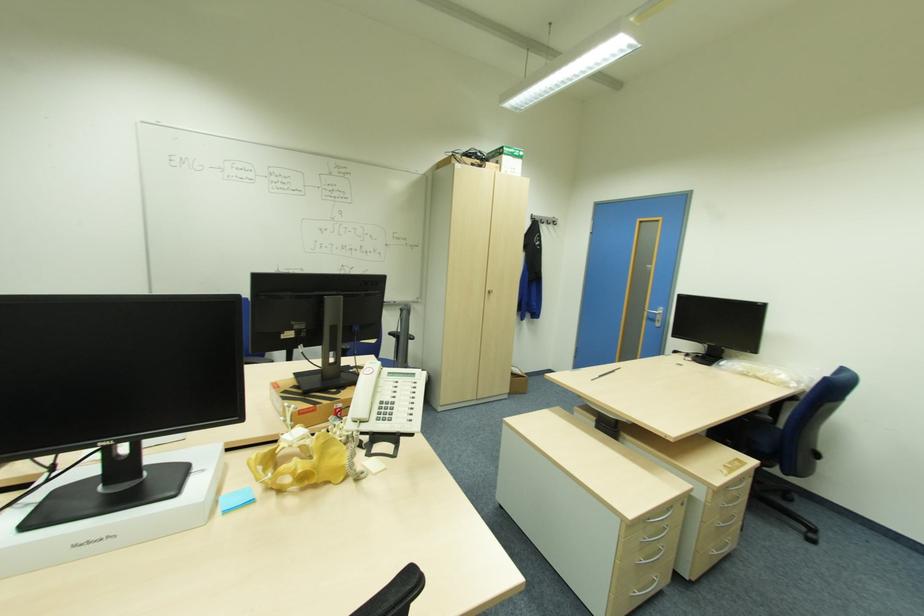
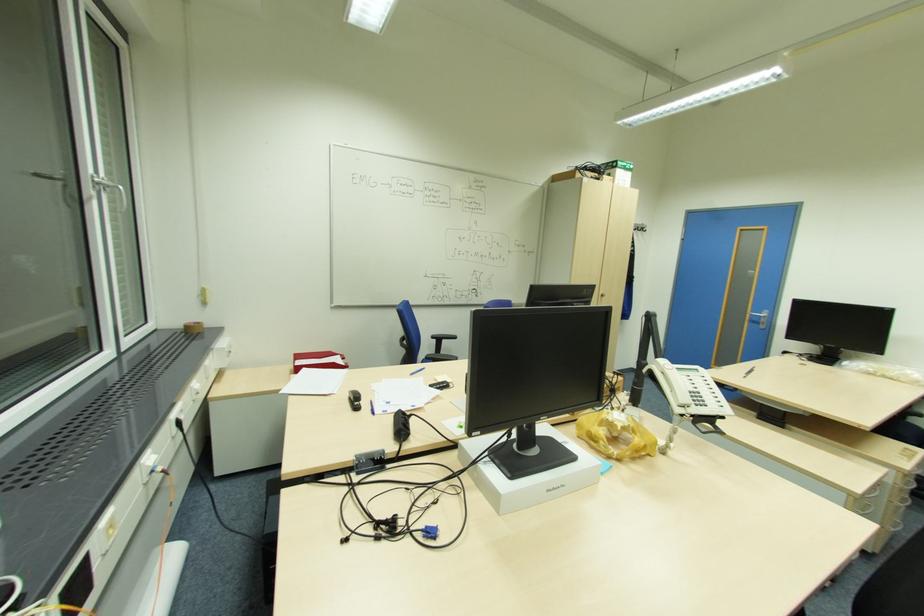
Question: The images are taken continuously from a first-person perspective. In which direction are you moving?

Choices:
 (A) Left
 (B) Right
 (C) Forward
 (D) Backward

Answer: (A)